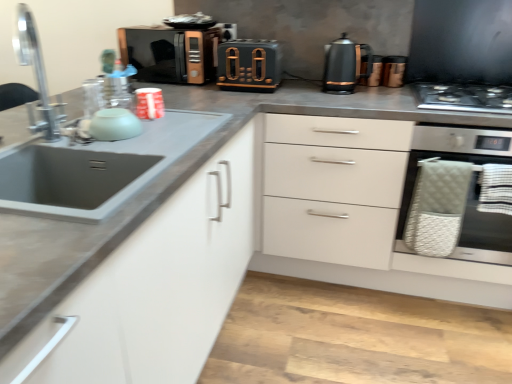
Locate an element on the screen. empty space that is to the right of matte green bowl at left, which is counted as the fifth appliance, starting from the back is located at coordinates (172, 129).